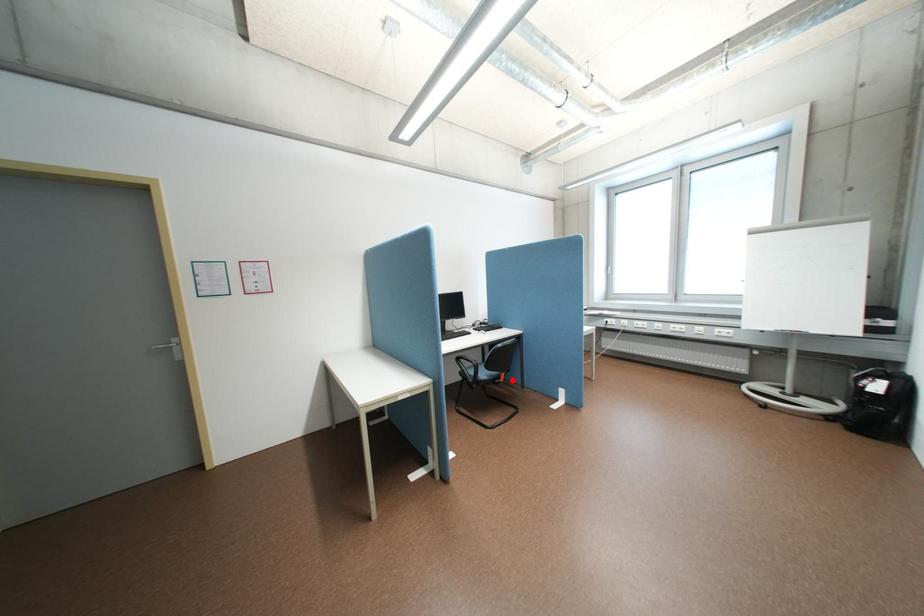
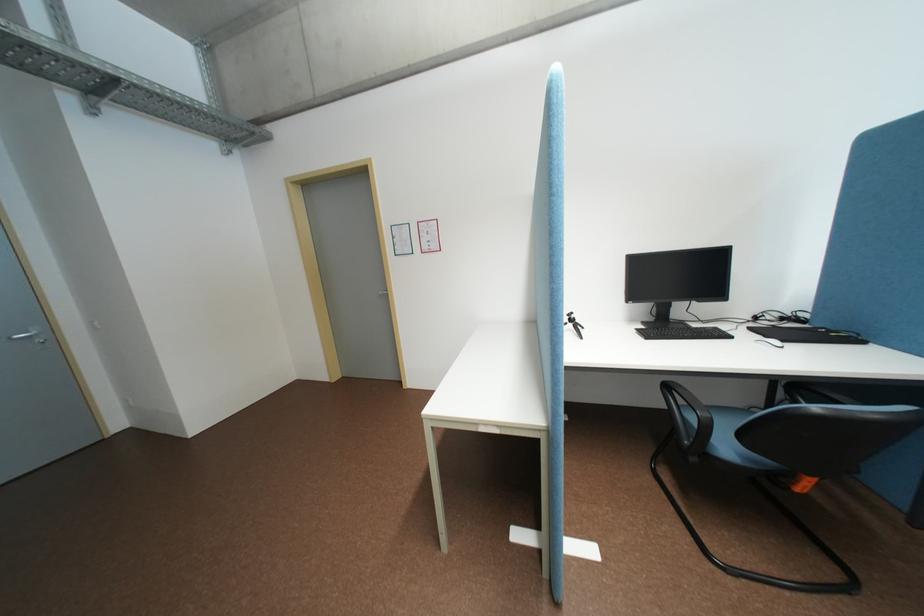
The point at the highlighted location is marked in the first image. Where is the corresponding point in the second image?

(808, 488)